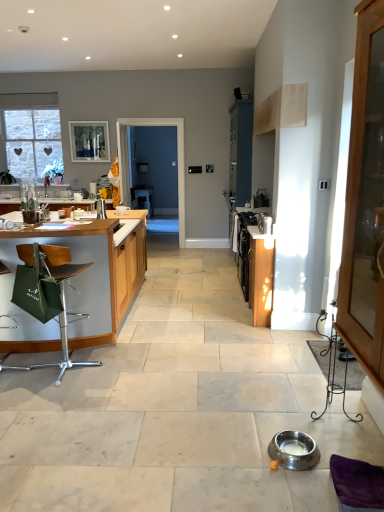
Describe the element at coordinates (357, 483) in the screenshot. The image size is (384, 512). I see `purple fabric swivel chair at lower right` at that location.

I want to click on purple fabric swivel chair at lower right, so click(357, 483).

At what (x,y) coordinates should I click in order to perform the action: click on satin silver kettle at center-right, marked as the second appliance in a front-to-back arrangement. Please return your answer as a coordinate pair (x, y). This screenshot has width=384, height=512. Looking at the image, I should click on (264, 223).

In the scene shown: Measure the distance between point (41, 284) and camera.

The depth of point (41, 284) is 9.54 feet.

Identify the location of matte glass window screen at upper left. (89, 141).

What do you see at coordinates (81, 282) in the screenshot? I see `green fabric table at left` at bounding box center [81, 282].

Image resolution: width=384 pixels, height=512 pixels. What are the coordinates of `wooden cabinet at right, the second cabinetry when ordered from front to back` in the screenshot? It's located at (261, 276).

Which of these two, green leather chair at left or green fabric table at left, is bigger?

With larger size is green fabric table at left.

Between green leather chair at left and green fabric table at left, which one appears on the right side from the viewer's perspective?

green leather chair at left is more to the right.

From a real-world perspective, which object stands above the other?

green fabric table at left is physically above.

From the image's perspective, is green leather chair at left located above or below green fabric table at left?

green leather chair at left is situated lower than green fabric table at left in the image.

Does light wood cabinet at right, the 2th cabinetry viewed from the back, turn towards purple fabric swivel chair at lower right?

No, light wood cabinet at right, the 2th cabinetry viewed from the back, is not oriented towards purple fabric swivel chair at lower right.

Would you consider light wood cabinet at right, which is the first cabinetry from front to back, to be distant from purple fabric swivel chair at lower right?

No, there isn't a large distance between light wood cabinet at right, which is the first cabinetry from front to back, and purple fabric swivel chair at lower right.

Looking at this image, considering the sizes of light wood cabinet at right, which is the first cabinetry from front to back, and purple fabric swivel chair at lower right in the image, is light wood cabinet at right, which is the first cabinetry from front to back, taller or shorter than purple fabric swivel chair at lower right?

light wood cabinet at right, which is the first cabinetry from front to back, is taller than purple fabric swivel chair at lower right.

Is light wood cabinet at right, the 2th cabinetry viewed from the back, not within purple fabric swivel chair at lower right?

light wood cabinet at right, the 2th cabinetry viewed from the back, lies outside purple fabric swivel chair at lower right's area.

From a real-world perspective, is green fabric table at left located beneath satin silver kettle at center-right, marked as the second appliance in a front-to-back arrangement?

Yes, from a real-world perspective, green fabric table at left is beneath satin silver kettle at center-right, marked as the second appliance in a front-to-back arrangement.

Could you tell me if green fabric table at left is facing satin silver kettle at center-right, positioned as the 1th appliance in top-to-bottom order?

No.

Is green fabric table at left further to camera compared to satin silver kettle at center-right, marked as the second appliance in a bottom-to-top arrangement?

That is False.

How far apart are green fabric table at left and satin silver kettle at center-right, marked as the second appliance in a bottom-to-top arrangement?

5.47 feet.

Considering the relative sizes of green leather chair at left and satin silver kettle at center-right, positioned as the 1th appliance in top-to-bottom order, in the image provided, is green leather chair at left wider than satin silver kettle at center-right, positioned as the 1th appliance in top-to-bottom order,?

→ Correct, the width of green leather chair at left exceeds that of satin silver kettle at center-right, positioned as the 1th appliance in top-to-bottom order.

Is green leather chair at left turned away from satin silver kettle at center-right, marked as the second appliance in a bottom-to-top arrangement?

No, satin silver kettle at center-right, marked as the second appliance in a bottom-to-top arrangement, is not at the back of green leather chair at left.

Who is bigger, green leather chair at left or satin silver kettle at center-right, marked as the second appliance in a front-to-back arrangement?

With larger size is green leather chair at left.

Which is correct: green leather chair at left is inside satin silver kettle at center-right, the first appliance when ordered from back to front, or outside of it?

green leather chair at left is outside satin silver kettle at center-right, the first appliance when ordered from back to front.

From a real-world perspective, which object stands above the other?

light wood cabinet at right, which is the first cabinetry from front to back, is physically above.

Can you confirm if green leather chair at left is shorter than light wood cabinet at right, the 2th cabinetry viewed from the back?

Correct, green leather chair at left is not as tall as light wood cabinet at right, the 2th cabinetry viewed from the back.

Looking at the image, does green leather chair at left seem bigger or smaller compared to light wood cabinet at right, the 2th cabinetry viewed from the back?

Considering their sizes, green leather chair at left takes up less space than light wood cabinet at right, the 2th cabinetry viewed from the back.

Which of these two, matte glass window screen at upper left or stainless steel bowl at lower center, positioned as the first appliance in front-to-back order, is smaller?

stainless steel bowl at lower center, positioned as the first appliance in front-to-back order.

From a real-world perspective, who is located higher, matte glass window screen at upper left or stainless steel bowl at lower center, acting as the 2th appliance starting from the top?

matte glass window screen at upper left, from a real-world perspective.

Between matte glass window screen at upper left and stainless steel bowl at lower center, acting as the 2th appliance starting from the top, which one has less height?

stainless steel bowl at lower center, acting as the 2th appliance starting from the top.

Identify the location of appliance that is the 2nd one when counting forward from the matte glass window screen at upper left. (294, 450).

Is satin silver kettle at center-right, marked as the second appliance in a bottom-to-top arrangement, taller or shorter than stainless steel bowl at lower center, acting as the 2th appliance starting from the top?

Considering their sizes, satin silver kettle at center-right, marked as the second appliance in a bottom-to-top arrangement, has more height than stainless steel bowl at lower center, acting as the 2th appliance starting from the top.

From a real-world perspective, is satin silver kettle at center-right, the first appliance when ordered from back to front, positioned above or below stainless steel bowl at lower center, marked as the second appliance in a back-to-front arrangement?

satin silver kettle at center-right, the first appliance when ordered from back to front, is above stainless steel bowl at lower center, marked as the second appliance in a back-to-front arrangement.

Looking at this image, can you confirm if satin silver kettle at center-right, the first appliance when ordered from back to front, is smaller than stainless steel bowl at lower center, acting as the 2th appliance starting from the top?

Yes, satin silver kettle at center-right, the first appliance when ordered from back to front, is smaller than stainless steel bowl at lower center, acting as the 2th appliance starting from the top.

Where is `table located behind the green leather chair at left`? table located behind the green leather chair at left is located at coordinates (81, 282).

Find the location of a particular element. The width and height of the screenshot is (384, 512). swivel chair to the left of light wood cabinet at right, which is the first cabinetry from front to back is located at coordinates (357, 483).

When comparing their distances from light wood cabinet at right, the 2th cabinetry viewed from the back, does matte glass window screen at upper left or stainless steel bowl at lower center, marked as the second appliance in a back-to-front arrangement, seem further?

Among the two, matte glass window screen at upper left is located further to light wood cabinet at right, the 2th cabinetry viewed from the back.

Consider the image. Which object lies further to the anchor point light wood cabinet at right, the 2th cabinetry viewed from the back, satin silver kettle at center-right, the first appliance when ordered from back to front, or purple fabric swivel chair at lower right?

satin silver kettle at center-right, the first appliance when ordered from back to front, is further to light wood cabinet at right, the 2th cabinetry viewed from the back.

When comparing their distances from purple fabric swivel chair at lower right, does green leather chair at left or satin silver kettle at center-right, the first appliance when ordered from back to front, seem further?

satin silver kettle at center-right, the first appliance when ordered from back to front.

Looking at the image, which one is located further to green fabric table at left, green leather chair at left or stainless steel bowl at lower center, acting as the 2th appliance starting from the top?

stainless steel bowl at lower center, acting as the 2th appliance starting from the top, is positioned further to the anchor green fabric table at left.

From the image, which object appears to be farther from wooden cabinet at right, the second cabinetry when ordered from front to back, transparent glass screen door at center or stainless steel bowl at lower center, positioned as the first appliance in front-to-back order?

transparent glass screen door at center is positioned further to the anchor wooden cabinet at right, the second cabinetry when ordered from front to back.

From the image, which object appears to be farther from stainless steel bowl at lower center, placed as the first appliance when sorted from bottom to top, transparent glass screen door at center or light wood cabinet at right, which is the first cabinetry from front to back?

Based on the image, transparent glass screen door at center appears to be further to stainless steel bowl at lower center, placed as the first appliance when sorted from bottom to top.

Based on their spatial positions, is stainless steel bowl at lower center, acting as the 2th appliance starting from the top, or matte glass window screen at upper left closer to transparent glass screen door at center?

The object closer to transparent glass screen door at center is matte glass window screen at upper left.

Based on their spatial positions, is transparent glass screen door at center or green fabric table at left closer to purple fabric swivel chair at lower right?

green fabric table at left is closer to purple fabric swivel chair at lower right.

You are a GUI agent. You are given a task and a screenshot of the screen. Output one action in this format:
    pyautogui.click(x=<x>, y=<y>)
    Task: Click on the swivel chair situated between green fabric table at left and light wood cabinet at right, the 2th cabinetry viewed from the back, from left to right
    
    Given the screenshot: What is the action you would take?
    pyautogui.click(x=357, y=483)

Where is `chair located between light wood cabinet at right, the 2th cabinetry viewed from the back, and wooden cabinet at right, the second cabinetry when ordered from front to back, in the depth direction`? chair located between light wood cabinet at right, the 2th cabinetry viewed from the back, and wooden cabinet at right, the second cabinetry when ordered from front to back, in the depth direction is located at coordinates (49, 292).

This screenshot has width=384, height=512. In order to click on chair between light wood cabinet at right, the 2th cabinetry viewed from the back, and matte glass window screen at upper left from front to back in this screenshot , I will do `click(49, 292)`.

The height and width of the screenshot is (512, 384). I want to click on screen door positioned between wooden cabinet at right, arranged as the first cabinetry when viewed from the back, and matte glass window screen at upper left from near to far, so click(177, 161).